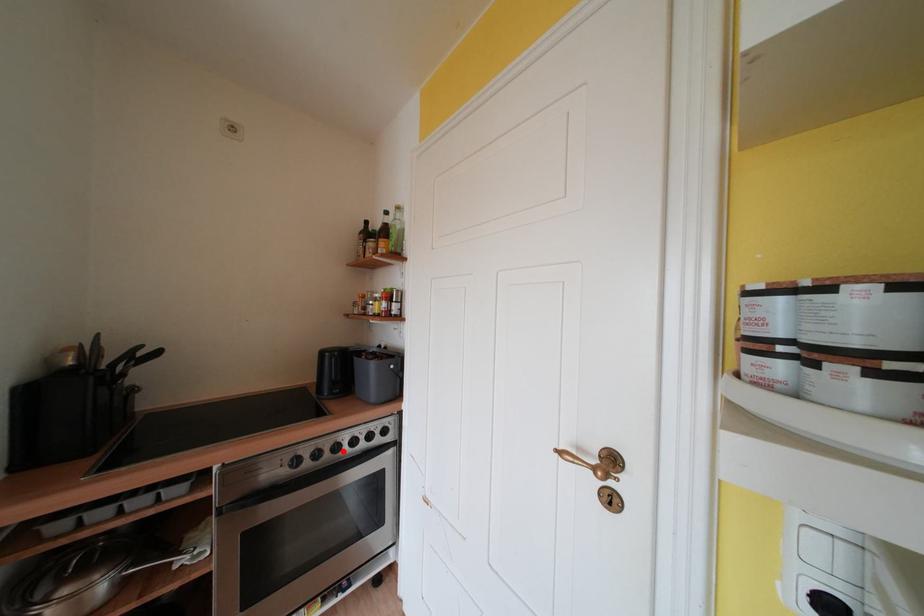
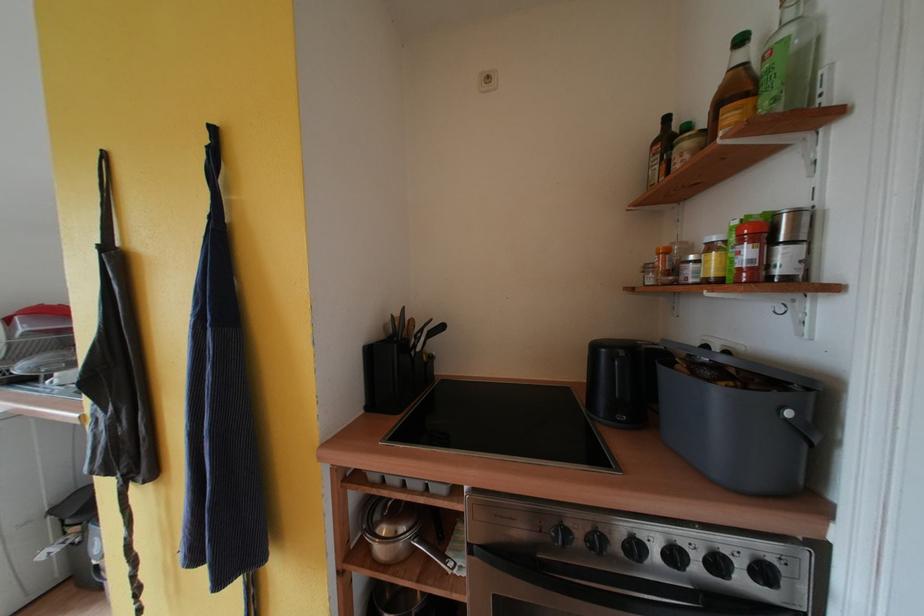
Where in the second image is the point corresponding to the highlighted location from the first image?

(641, 551)